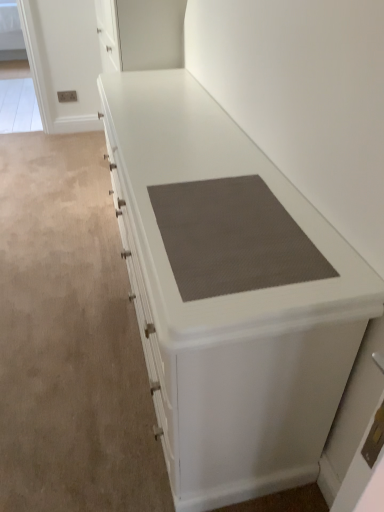
At what (x,y) coordinates should I click in order to perform the action: click on vacant area on top of white textured cabinet at center (from a real-world perspective). Please return your answer as a coordinate pair (x, y). Image resolution: width=384 pixels, height=512 pixels. Looking at the image, I should click on (180, 138).